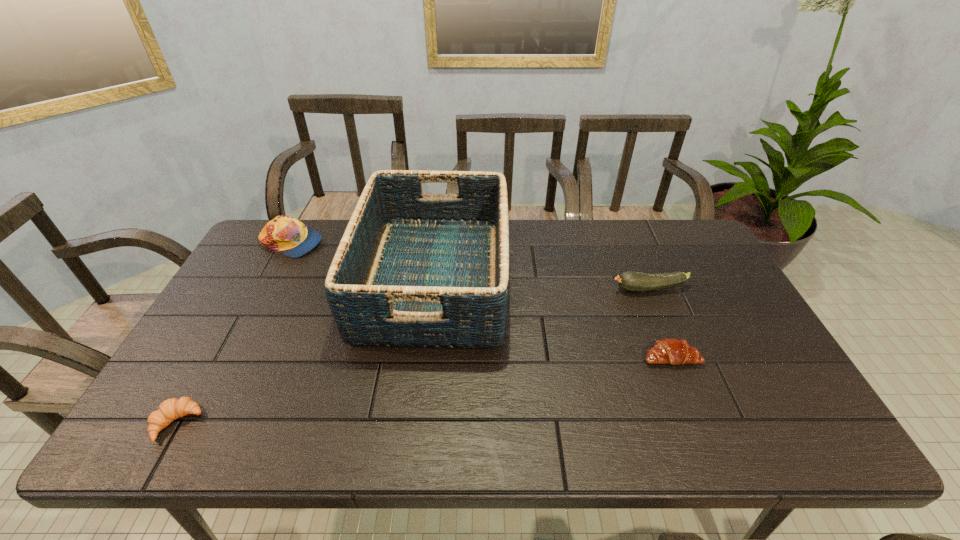
This screenshot has height=540, width=960. What are the coordinates of `the tallest object` in the screenshot? It's located at (413, 269).

Identify the location of the third object from right to left. Image resolution: width=960 pixels, height=540 pixels. (413, 269).

Where is `cap`? This screenshot has width=960, height=540. cap is located at coordinates (287, 235).

This screenshot has height=540, width=960. In order to click on the third tallest object in this screenshot , I will do `click(631, 281)`.

The width and height of the screenshot is (960, 540). What are the coordinates of `the farther crescent roll` in the screenshot? It's located at [674, 351].

This screenshot has width=960, height=540. I want to click on the left crescent roll, so click(169, 410).

The height and width of the screenshot is (540, 960). Identify the location of the nearer crescent roll. (169, 410).

Find the location of a particular element. This screenshot has width=960, height=540. free space located 0.060m on the left of the tallest object is located at coordinates (340, 279).

The height and width of the screenshot is (540, 960). Identify the location of vacant region located on the bill of the cap. (393, 243).

The image size is (960, 540). What are the coordinates of `free space located 0.210m at the blossom end of the third tallest object` in the screenshot? It's located at (540, 289).